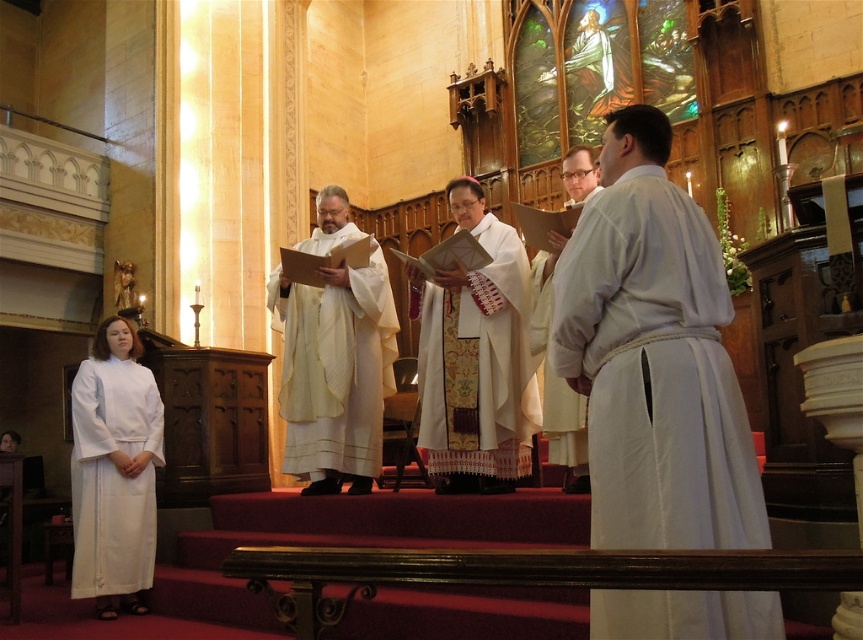
Is white matte robe at center above white clothed man at center?

Indeed, white matte robe at center is positioned over white clothed man at center.

Which is behind, point (600, 273) or point (576, 198)?

Point (576, 198)

What do you see at coordinates (654, 372) in the screenshot? I see `white matte robe at center` at bounding box center [654, 372].

Locate an element on the screen. This screenshot has height=640, width=863. white matte robe at center is located at coordinates (654, 372).

Which is above, white textured fabric at center or white satin robe at center?

white textured fabric at center is higher up.

Between white textured fabric at center and white satin robe at center, which one appears on the left side from the viewer's perspective?

white satin robe at center is more to the left.

Who is more forward, (x=421, y=426) or (x=295, y=292)?

Point (x=421, y=426) is in front.

Where is `white textured fabric at center`? white textured fabric at center is located at coordinates (477, 362).

Is white satin robe at center positioned before white clothed man at center?

No.

Describe the element at coordinates (334, 369) in the screenshot. The width and height of the screenshot is (863, 640). I see `white satin robe at center` at that location.

Locate an element on the screen. This screenshot has height=640, width=863. white satin robe at center is located at coordinates (334, 369).